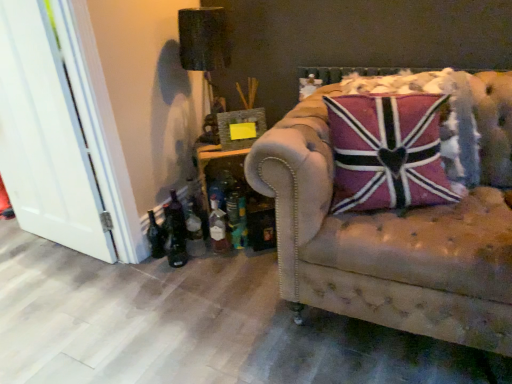
Where is `vacant space to the left of white wood door at left`? The image size is (512, 384). vacant space to the left of white wood door at left is located at coordinates (27, 244).